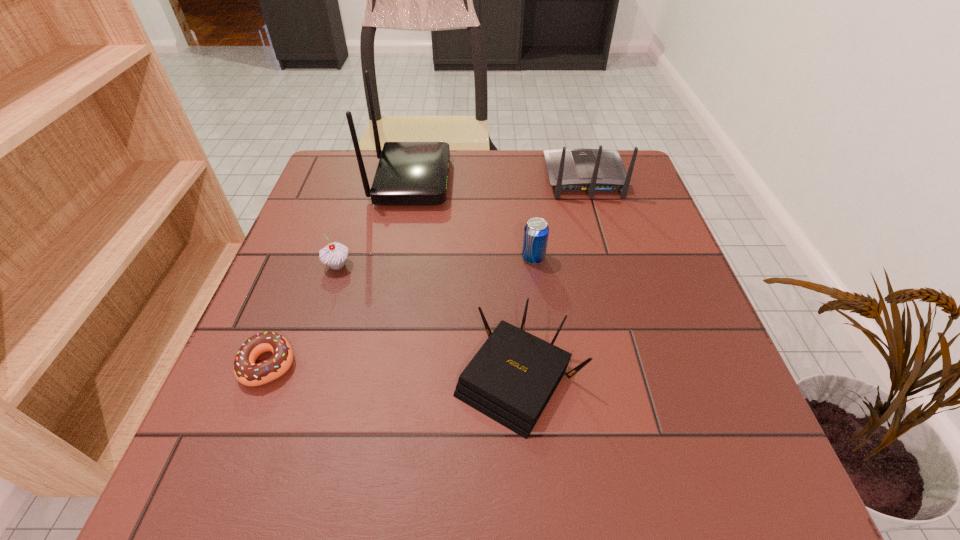
You are a GUI agent. You are given a task and a screenshot of the screen. Output one action in this format:
    pyautogui.click(x=<x>, y=<y>)
    Task: Click on the free area in between the cupcake and the second tallest object
    The height and width of the screenshot is (540, 960).
    Given the screenshot: What is the action you would take?
    pyautogui.click(x=461, y=221)

Identify the location of free space between the cupcake and the fifth shortest object. This screenshot has height=540, width=960. (461, 221).

Where is `blank region between the fifth shortest object and the beer can`? blank region between the fifth shortest object and the beer can is located at coordinates (559, 218).

Select which object is the fourth closest to the cupcake. Please provide its 2D coordinates. Your answer should be formatted as a tuple, i.e. [(x, y)], where the tuple contains the x and y coordinates of a point satisfying the conditions above.

[(536, 231)]

Locate which object is the third closest to the beer can. Please provide its 2D coordinates. Your answer should be formatted as a tuple, i.e. [(x, y)], where the tuple contains the x and y coordinates of a point satisfying the conditions above.

[(409, 173)]

The height and width of the screenshot is (540, 960). I want to click on router that is the second closest to the tallest object, so click(512, 377).

I want to click on router that stands as the closest to the shortest object, so click(x=512, y=377).

This screenshot has height=540, width=960. Identify the location of free region that satisfies the following two spatial constraints: 1. on the back side of the doughnut; 2. on the left side of the beer can. (310, 258).

At what (x,y) coordinates should I click in order to perform the action: click on free location that satisfies the following two spatial constraints: 1. on the back side of the cupcake; 2. on the right side of the beer can. Please return your answer as a coordinate pair (x, y). This screenshot has width=960, height=540. Looking at the image, I should click on (340, 258).

Find the location of a particular element. The width and height of the screenshot is (960, 540). vacant space that satisfies the following two spatial constraints: 1. on the back side of the cupcake; 2. on the left side of the beer can is located at coordinates coord(340,258).